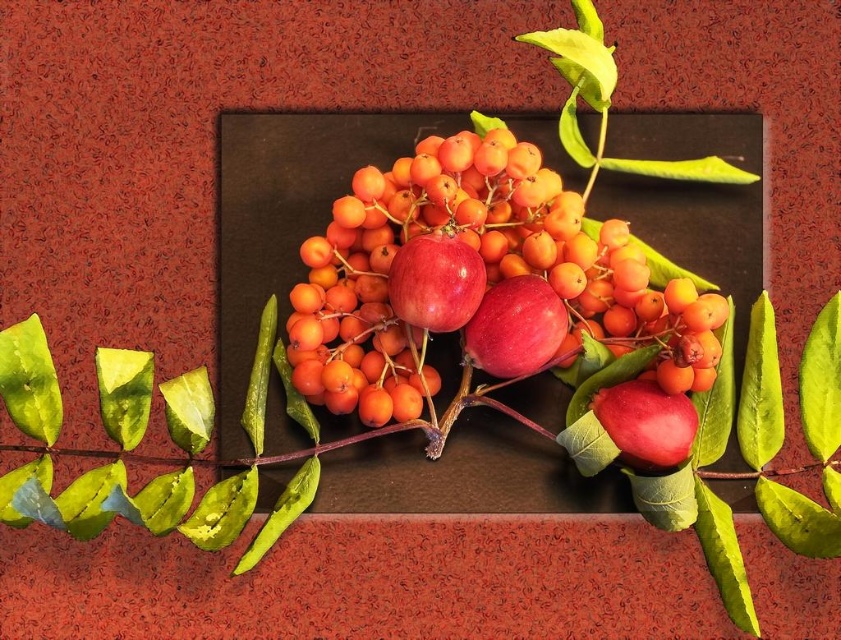
Is glossy red apples at center smaller than glossy red apple at center?

Actually, glossy red apples at center might be larger than glossy red apple at center.

Does point (593, 259) come behind point (516, 365)?

Yes, point (593, 259) is behind point (516, 365).

This screenshot has height=640, width=841. What are the coordinates of `glossy red apples at center` in the screenshot? It's located at (485, 269).